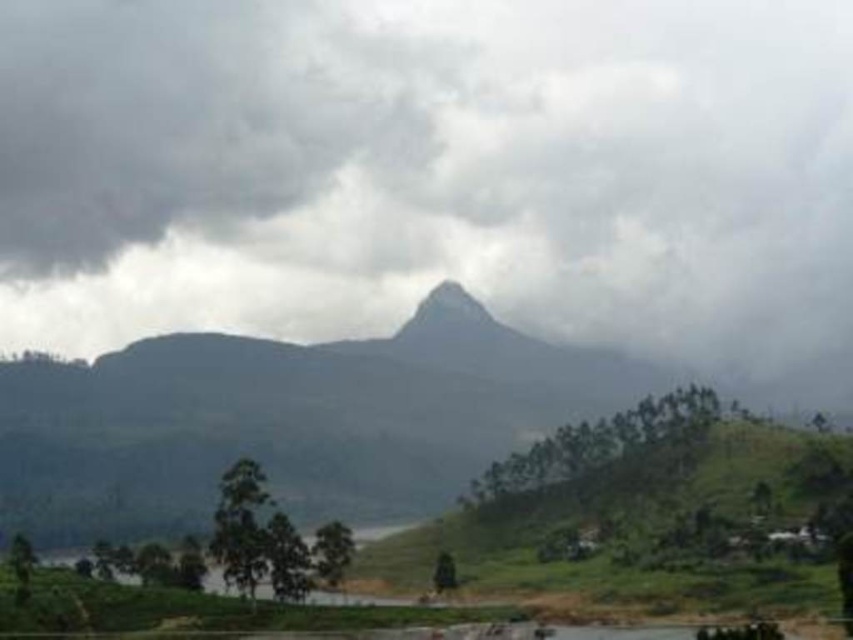
You are an airplane pilot preparing to land in this area. You need to determine if the runway is visible between the gray cloudy sky at center and the dark gray rocky mountain at center. Can you see the runway?

The gray cloudy sky at center might be wider than dark gray rocky mountain at center, so the runway may not be visible between them due to the width of the sky obscuring the view.

You are a hiker planning to take a photo of the dark gray rocky mountain at center from the gray cloudy sky at center. Is the mountain fully visible from that position?

The gray cloudy sky at center is much taller than the dark gray rocky mountain at center, so the mountain would be partially obscured by the sky, making it not fully visible from that position.